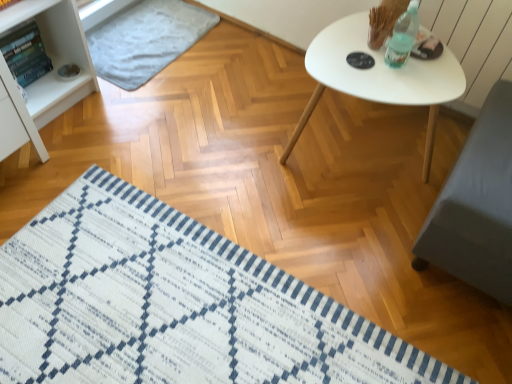
What is the approximate width of light gray textured mat at upper left, positioned as the 1th mat in top-to-bottom order?

light gray textured mat at upper left, positioned as the 1th mat in top-to-bottom order, is 18.89 inches in width.

The width and height of the screenshot is (512, 384). Describe the element at coordinates (377, 77) in the screenshot. I see `white matte table at upper right` at that location.

In order to click on light gray textured mat at upper left, positioned as the 1th mat in top-to-bottom order in this screenshot , I will do `click(145, 39)`.

Is light gray textured mat at upper left, the 2th mat viewed from the front, not inside white woven mat at lower left, the first mat when ordered from front to back?

Yes.

Is light gray textured mat at upper left, acting as the first mat starting from the back, looking in the opposite direction of white woven mat at lower left, marked as the 2th mat in a back-to-front arrangement?

No, light gray textured mat at upper left, acting as the first mat starting from the back, is not facing away from white woven mat at lower left, marked as the 2th mat in a back-to-front arrangement.

Is light gray textured mat at upper left, the 2th mat viewed from the front, thinner than white woven mat at lower left, marked as the 2th mat in a back-to-front arrangement?

Yes.

Which of these two, light gray textured mat at upper left, positioned as the 1th mat in top-to-bottom order, or white woven mat at lower left, the 2th mat when ordered from top to bottom, stands taller?

white woven mat at lower left, the 2th mat when ordered from top to bottom.

From the image's perspective, between white woven mat at lower left, the 2th mat when ordered from top to bottom, and light gray textured mat at upper left, the second mat positioned from the bottom, who is located below?

white woven mat at lower left, the 2th mat when ordered from top to bottom, appears lower in the image.

Which is more to the left, white woven mat at lower left, which ranks as the first mat in bottom-to-top order, or light gray textured mat at upper left, the second mat positioned from the bottom?

light gray textured mat at upper left, the second mat positioned from the bottom.

From a real-world perspective, is white woven mat at lower left, the 2th mat when ordered from top to bottom, located higher than light gray textured mat at upper left, positioned as the 1th mat in top-to-bottom order?

No, from a real-world perspective, white woven mat at lower left, the 2th mat when ordered from top to bottom, is not over light gray textured mat at upper left, positioned as the 1th mat in top-to-bottom order

Can you see white woven mat at lower left, which ranks as the first mat in bottom-to-top order, touching light gray textured mat at upper left, positioned as the 1th mat in top-to-bottom order?

No, white woven mat at lower left, which ranks as the first mat in bottom-to-top order, is not in contact with light gray textured mat at upper left, positioned as the 1th mat in top-to-bottom order.

In the scene shown: How many degrees apart are the facing directions of light gray textured mat at upper left, acting as the first mat starting from the back, and white matte table at upper right?

The angle between the facing direction of light gray textured mat at upper left, acting as the first mat starting from the back, and the facing direction of white matte table at upper right is 92.1 degrees.

Is the position of light gray textured mat at upper left, the second mat positioned from the bottom, more distant than that of white matte table at upper right?

Yes, it is.

Where is `table above the light gray textured mat at upper left, the second mat positioned from the bottom (from a real-world perspective)`? Image resolution: width=512 pixels, height=384 pixels. table above the light gray textured mat at upper left, the second mat positioned from the bottom (from a real-world perspective) is located at coordinates (377, 77).

Based on their positions, is light gray textured mat at upper left, the second mat positioned from the bottom, located to the left or right of white matte table at upper right?

Based on their positions, light gray textured mat at upper left, the second mat positioned from the bottom, is located to the left of white matte table at upper right.

From the image's perspective, which one is positioned lower, white woven mat at lower left, the first mat when ordered from front to back, or white matte table at upper right?

white woven mat at lower left, the first mat when ordered from front to back, appears lower in the image.

Considering the sizes of objects white woven mat at lower left, the 2th mat when ordered from top to bottom, and white matte table at upper right in the image provided, who is smaller, white woven mat at lower left, the 2th mat when ordered from top to bottom, or white matte table at upper right?

With smaller size is white woven mat at lower left, the 2th mat when ordered from top to bottom.

Can you confirm if white woven mat at lower left, the first mat when ordered from front to back, is positioned to the left of white matte table at upper right?

Yes, white woven mat at lower left, the first mat when ordered from front to back, is to the left of white matte table at upper right.

Is white woven mat at lower left, the 2th mat when ordered from top to bottom, oriented away from white matte table at upper right?

No.

Is point (428, 68) farther from viewer compared to point (177, 46)?

No, it is in front of (177, 46).

Which of these two, white matte table at upper right or light gray textured mat at upper left, the 2th mat viewed from the front, stands shorter?

Standing shorter between the two is light gray textured mat at upper left, the 2th mat viewed from the front.

Is white matte table at upper right positioned with its back to light gray textured mat at upper left, the second mat positioned from the bottom?

No, white matte table at upper right's orientation is not away from light gray textured mat at upper left, the second mat positioned from the bottom.

Is white matte table at upper right positioned in front of white woven mat at lower left, marked as the 2th mat in a back-to-front arrangement?

No, the depth of white matte table at upper right is greater than that of white woven mat at lower left, marked as the 2th mat in a back-to-front arrangement.

Which object is positioned more to the right, white matte table at upper right or white woven mat at lower left, the first mat when ordered from front to back?

white matte table at upper right.

Could you tell me if white matte table at upper right is facing white woven mat at lower left, the first mat when ordered from front to back?

Yes, white matte table at upper right is turned towards white woven mat at lower left, the first mat when ordered from front to back.

Looking at their sizes, would you say white matte table at upper right is wider or thinner than white woven mat at lower left, which ranks as the first mat in bottom-to-top order?

Clearly, white matte table at upper right has less width compared to white woven mat at lower left, which ranks as the first mat in bottom-to-top order.

Where is `mat below the light gray textured mat at upper left, acting as the first mat starting from the back (from a real-world perspective)`? mat below the light gray textured mat at upper left, acting as the first mat starting from the back (from a real-world perspective) is located at coordinates (x=173, y=305).

The width and height of the screenshot is (512, 384). I want to click on mat on the right of light gray textured mat at upper left, the second mat positioned from the bottom, so click(x=173, y=305).

From the image, which object appears to be nearer to light gray textured mat at upper left, positioned as the 1th mat in top-to-bottom order, white matte table at upper right or white woven mat at lower left, marked as the 2th mat in a back-to-front arrangement?

The object closer to light gray textured mat at upper left, positioned as the 1th mat in top-to-bottom order, is white matte table at upper right.

From the image, which object appears to be farther from white woven mat at lower left, marked as the 2th mat in a back-to-front arrangement, white matte table at upper right or light gray textured mat at upper left, positioned as the 1th mat in top-to-bottom order?

The object further to white woven mat at lower left, marked as the 2th mat in a back-to-front arrangement, is light gray textured mat at upper left, positioned as the 1th mat in top-to-bottom order.

When comparing their distances from white matte table at upper right, does light gray textured mat at upper left, acting as the first mat starting from the back, or white woven mat at lower left, the first mat when ordered from front to back, seem further?

light gray textured mat at upper left, acting as the first mat starting from the back, is further to white matte table at upper right.

Based on their spatial positions, is white woven mat at lower left, the 2th mat when ordered from top to bottom, or white matte table at upper right further from light gray textured mat at upper left, the second mat positioned from the bottom?

white woven mat at lower left, the 2th mat when ordered from top to bottom, is further to light gray textured mat at upper left, the second mat positioned from the bottom.

When comparing their distances from white matte table at upper right, does white woven mat at lower left, which ranks as the first mat in bottom-to-top order, or light gray textured mat at upper left, the second mat positioned from the bottom, seem closer?

The object closer to white matte table at upper right is white woven mat at lower left, which ranks as the first mat in bottom-to-top order.

Considering their positions, is light gray textured mat at upper left, positioned as the 1th mat in top-to-bottom order, positioned closer to white woven mat at lower left, the first mat when ordered from front to back, than white matte table at upper right?

white matte table at upper right is closer to white woven mat at lower left, the first mat when ordered from front to back.

Identify the location of table between light gray textured mat at upper left, acting as the first mat starting from the back, and white woven mat at lower left, which ranks as the first mat in bottom-to-top order, vertically. This screenshot has width=512, height=384. (377, 77).